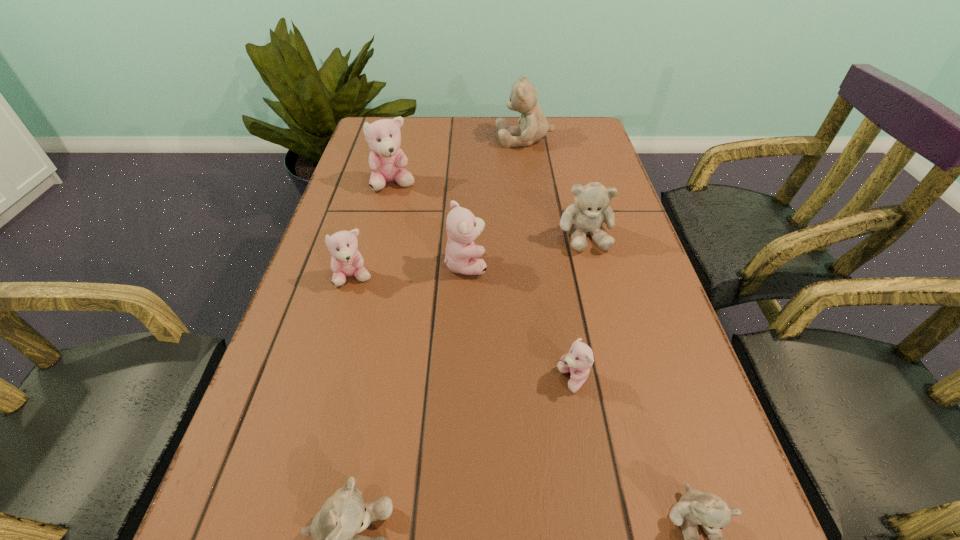
I want to click on the second farthest teddy bear, so click(x=387, y=161).

At what (x,y) coordinates should I click in order to perform the action: click on the farthest pink teddy bear. Please return your answer as a coordinate pair (x, y). Image resolution: width=960 pixels, height=540 pixels. Looking at the image, I should click on (387, 161).

You are a GUI agent. You are given a task and a screenshot of the screen. Output one action in this format:
    pyautogui.click(x=<x>, y=<y>)
    Task: Click on the farthest gray teddy bear
    
    Given the screenshot: What is the action you would take?
    pyautogui.click(x=533, y=127)

Locate an element on the screen. the farthest teddy bear is located at coordinates (533, 127).

Where is `the fourth object from left to right`? This screenshot has height=540, width=960. the fourth object from left to right is located at coordinates (462, 226).

Identify the location of the third smallest pink teddy bear. (462, 226).

Where is `the third smallest gray teddy bear`? The width and height of the screenshot is (960, 540). the third smallest gray teddy bear is located at coordinates (591, 208).

Image resolution: width=960 pixels, height=540 pixels. Identify the location of the second smallest pink teddy bear. (346, 261).

Image resolution: width=960 pixels, height=540 pixels. What are the coordinates of `the third nearest object` in the screenshot? It's located at (578, 361).

This screenshot has height=540, width=960. I want to click on the third nearest teddy bear, so click(578, 361).